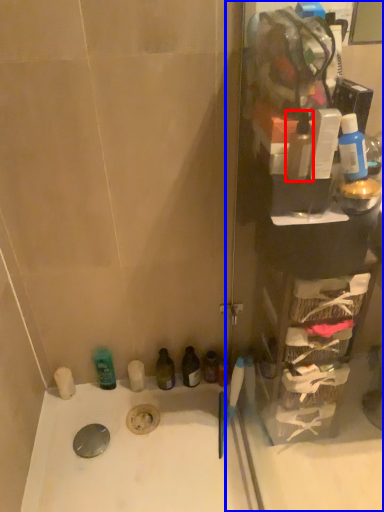
Question: Among these objects, which one is nearest to the camera, mouthwash (highlighted by a red box) or glass door (highlighted by a blue box)?

Choices:
 (A) mouthwash
 (B) glass door

Answer: (B)